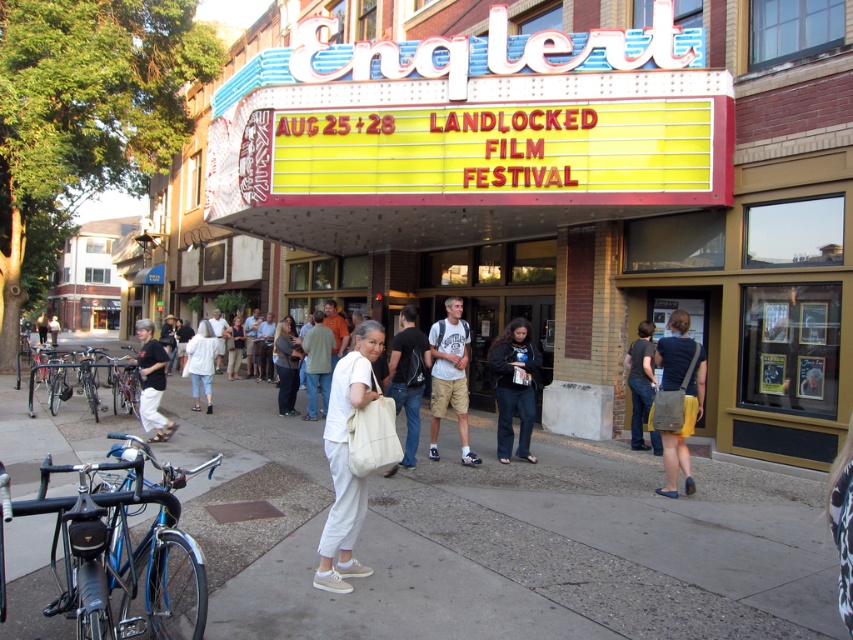
Who is positioned more to the left, gray concrete sidewalk at center or white canvas bag at center?

Positioned to the left is gray concrete sidewalk at center.

Which is above, gray concrete sidewalk at center or white canvas bag at center?

white canvas bag at center is above.

Does point (799, 609) come in front of point (410, 454)?

Yes.

Locate an element on the screen. gray concrete sidewalk at center is located at coordinates (502, 538).

Is point (426, 372) positioned before point (646, 385)?

Yes, it is.

From the picture: Is white canvas bag at center thinner than dark blue shirt at center?

No.

Is point (410, 342) positioned after point (643, 337)?

That is False.

Where is `white canvas bag at center`? The height and width of the screenshot is (640, 853). white canvas bag at center is located at coordinates (405, 378).

Measure the distance between black cotton shirt at left and dark blue shirt at center.

A distance of 22.45 feet exists between black cotton shirt at left and dark blue shirt at center.

Describe the element at coordinates (151, 381) in the screenshot. This screenshot has height=640, width=853. I see `black cotton shirt at left` at that location.

You are a GUI agent. You are given a task and a screenshot of the screen. Output one action in this format:
    pyautogui.click(x=<x>, y=<y>)
    Task: Click on the black cotton shirt at left
    
    Given the screenshot: What is the action you would take?
    pyautogui.click(x=151, y=381)